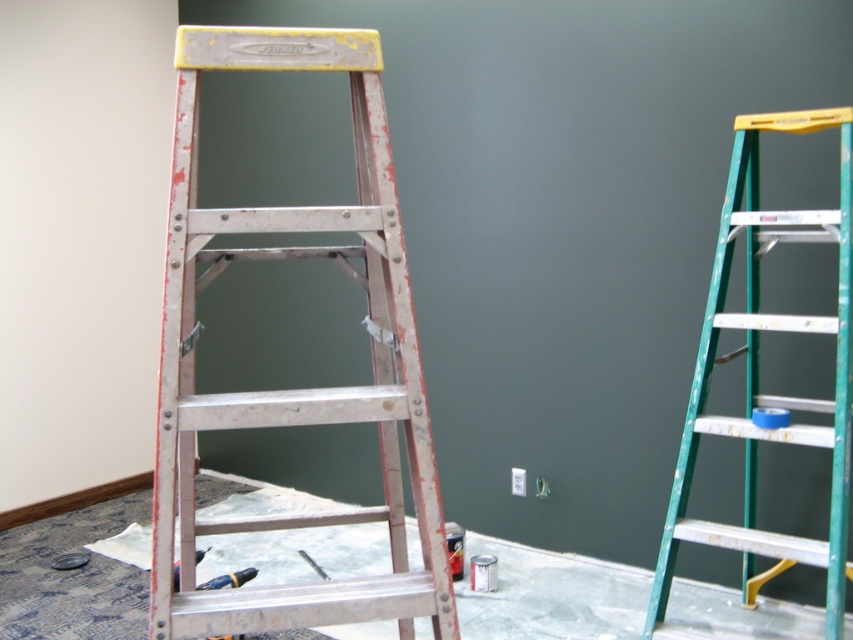
Question: Can you confirm if silver metallic ladder at center is positioned to the right of yellow plastic drill at lower left?

Choices:
 (A) yes
 (B) no

Answer: (A)

Question: Which point is closer to the camera?

Choices:
 (A) (213, 579)
 (B) (381, 364)

Answer: (B)

Question: Does green metallic ladder at right come in front of yellow plastic drill at lower left?

Choices:
 (A) no
 (B) yes

Answer: (B)

Question: Is green metallic ladder at right positioned behind yellow plastic drill at lower left?

Choices:
 (A) no
 (B) yes

Answer: (A)

Question: Which point is farther to the camera?

Choices:
 (A) (718, 422)
 (B) (236, 573)
 (C) (325, 577)

Answer: (C)

Question: Which of the following is the farthest from the observer?

Choices:
 (A) green metallic ladder at right
 (B) metallic silver screwdriver at lower center

Answer: (B)